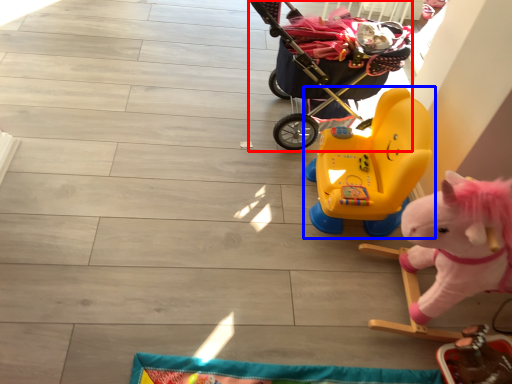
Question: Among these objects, which one is farthest to the camera, baby carriage (highlighted by a red box) or toy (highlighted by a blue box)?

Choices:
 (A) baby carriage
 (B) toy

Answer: (A)